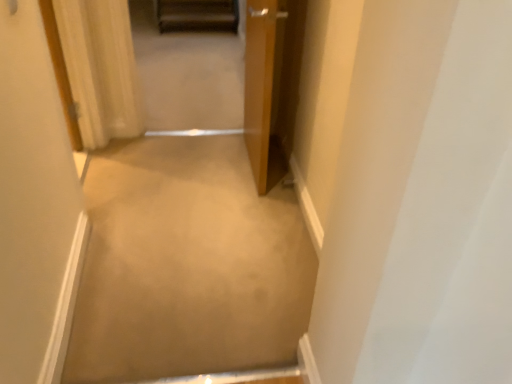
Question: Based on their positions, is beige carpet at center located to the left or right of white wood door at left, placed as the first door when sorted from left to right?

Choices:
 (A) right
 (B) left

Answer: (A)

Question: From the image's perspective, is beige carpet at center located above or below white wood door at left, which is counted as the 2th door, starting from the right?

Choices:
 (A) above
 (B) below

Answer: (B)

Question: Which is farther from the beige carpet at center?

Choices:
 (A) white wood door at left, placed as the first door when sorted from left to right
 (B) wooden door at center, positioned as the second door in left-to-right order
 (C) wooden door at upper left

Answer: (C)

Question: Which is farther from the white wood door at left, placed as the first door when sorted from left to right?

Choices:
 (A) beige carpet at center
 (B) wooden door at upper left
 (C) wooden door at center, placed as the first door when sorted from right to left

Answer: (B)